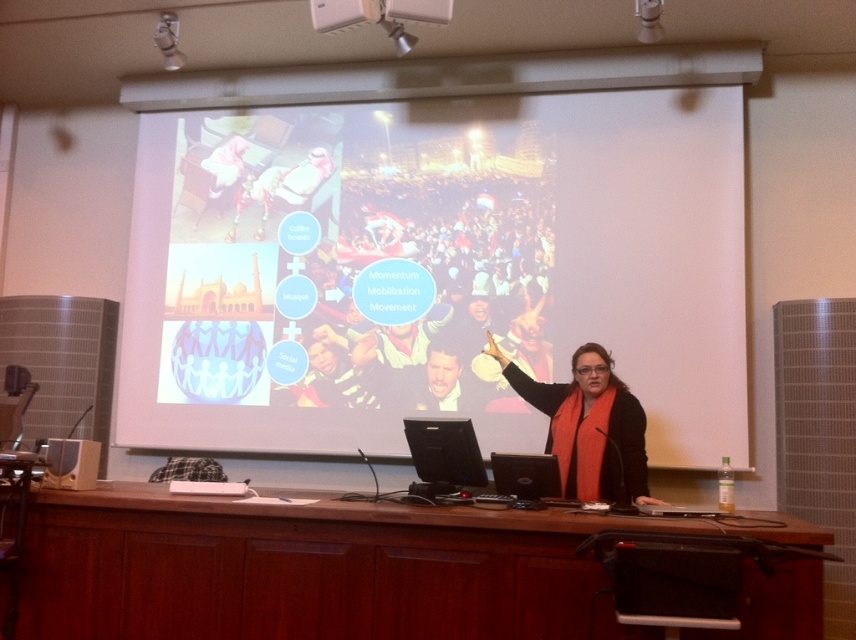
In the presentation setting, there is a point at coordinates (435,292). What object is located at this point?

The point at coordinates (435,292) indicates the matte black laptop at center.

You are organizing a presentation and need to place a notebook on the podium. The notebook is 12 inches wide. The podium has a matte black laptop at center and a black fabric at center. Can the notebook fit on the podium without overlapping either object?

The matte black laptop at center is wider than the black fabric at center. Since the laptop is wider, the notebook may not fit if placed next to the laptop. However, if placed near the narrower black fabric, there might be space. Check the exact dimensions of the podium and objects for confirmation.

You are an attendee at the presentation and want to take a photo of the white matte projection screen at upper center and the brown wood table at center. Which object is higher up in the image?

The white matte projection screen at upper center is located above the brown wood table at center, so it is higher up in the image.